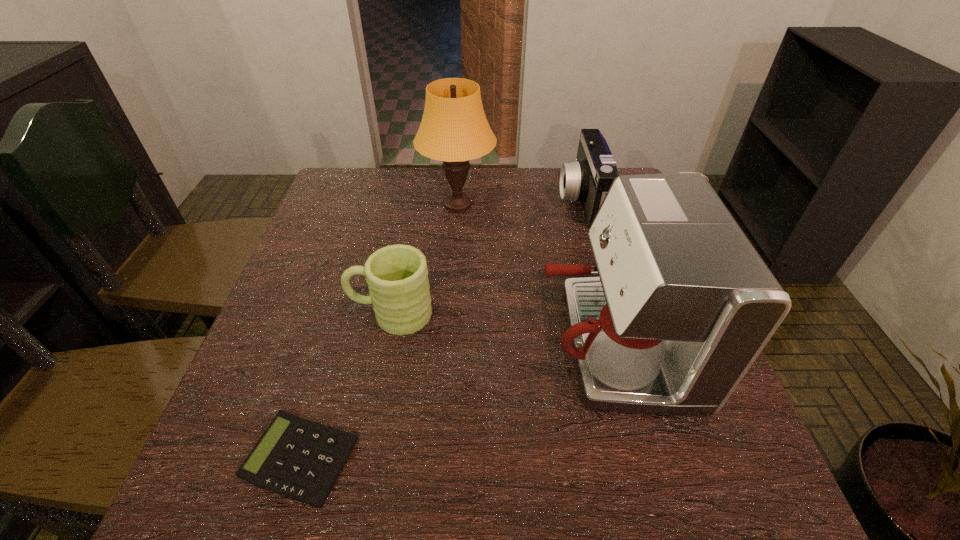
Where is `object that is at the near left corner`? This screenshot has height=540, width=960. object that is at the near left corner is located at coordinates (298, 458).

The width and height of the screenshot is (960, 540). Find the location of `object at the far right corner`. object at the far right corner is located at coordinates (588, 179).

The height and width of the screenshot is (540, 960). In order to click on vacant space at the far edge of the desktop in this screenshot , I will do `click(505, 203)`.

In the image, there is a desktop. Identify the location of free space at the near edge. (510, 485).

The height and width of the screenshot is (540, 960). In order to click on vacant region at the left edge of the desktop in this screenshot , I will do (x=239, y=382).

What are the coordinates of `free space at the far left corner of the desktop` in the screenshot? It's located at (372, 202).

Image resolution: width=960 pixels, height=540 pixels. Identify the location of free space at the near right corner. (691, 466).

I want to click on free spot between the coffee maker and the mug, so click(x=502, y=328).

Image resolution: width=960 pixels, height=540 pixels. In order to click on free space between the shortest object and the mug in this screenshot , I will do `click(347, 386)`.

Locate an element on the screen. The width and height of the screenshot is (960, 540). free space between the coffee maker and the mug is located at coordinates (502, 328).